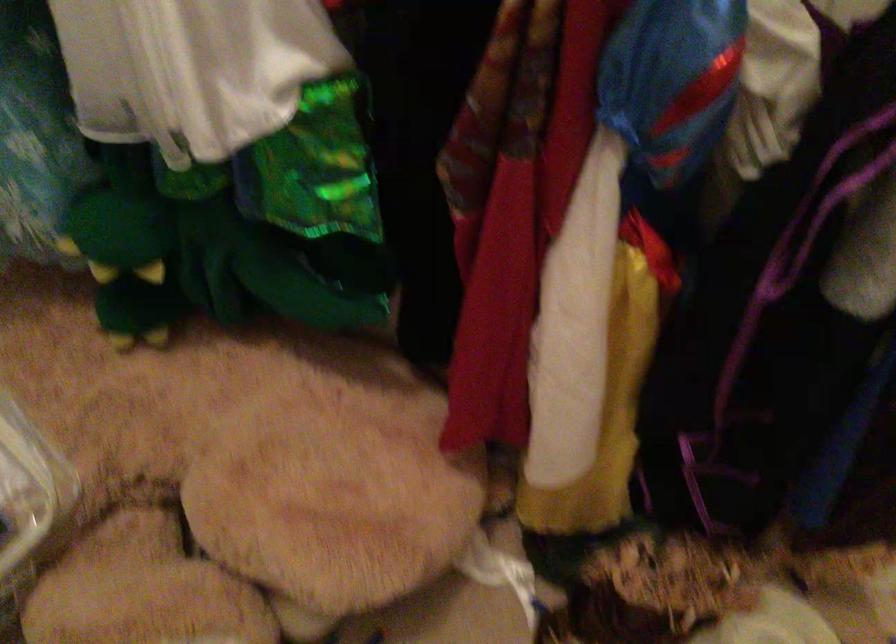
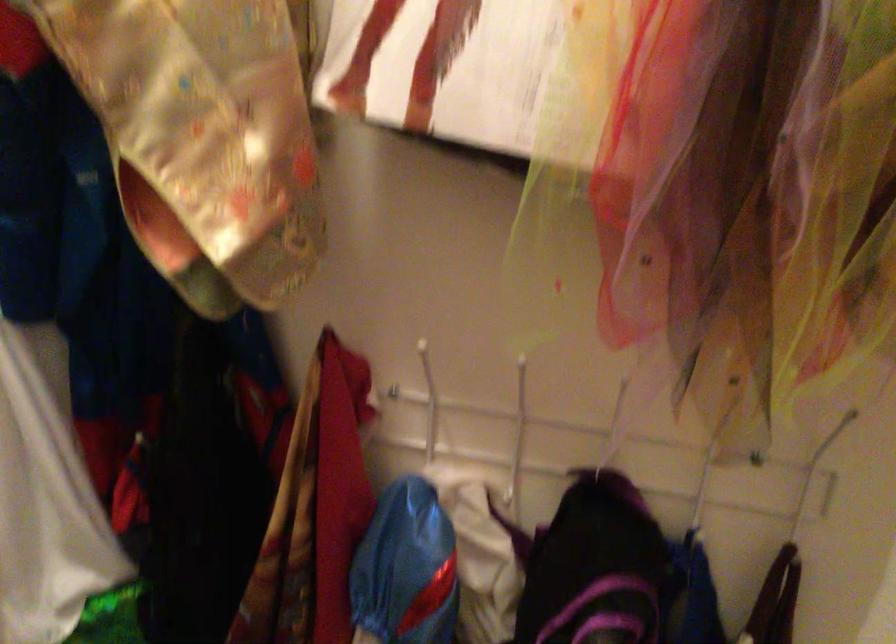
Question: The images are taken continuously from a first-person perspective. In which direction is your viewpoint rotating?

Choices:
 (A) Left
 (B) Right
 (C) Up
 (D) Down

Answer: (C)